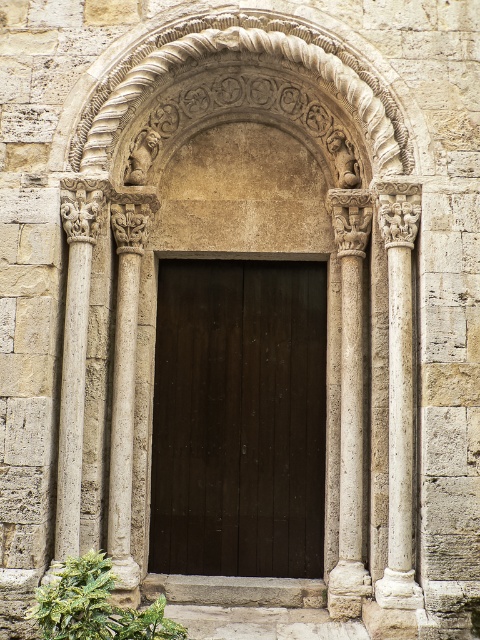
You are standing in front of the stone doorway and want to reach a point that is exactly at coordinates point (311, 486). If your current distance from the doorway is 20 meters, can you move forward to reach that point without passing it?

The distance of point (311, 486) from camera is 19.46 meters, so moving forward from 20 meters to 19.46 meters would allow you to reach the point without passing it.

From the picture: You are standing in front of the stone doorway and want to touch both columns. Which column should you reach for first, the white stone column at right or the smooth stone column at left?

You should reach for the white stone column at right first because it is closer to you than the smooth stone column at left, which is behind it.